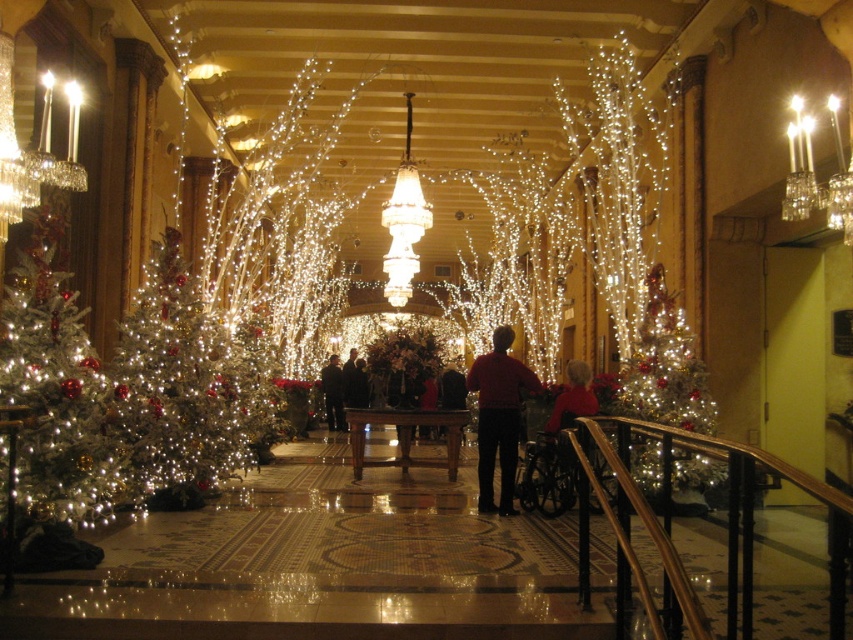
Question: Which of these objects is positioned farthest from the shiny silver christmas tree at right?

Choices:
 (A) dark red sweater at center
 (B) white frosted christmas tree at left

Answer: (B)

Question: Which point is farther to the camera?

Choices:
 (A) red velvet sweater at center
 (B) clear glass candlesticks at upper right

Answer: (A)

Question: Which of the following is the closest to the observer?

Choices:
 (A) (325, 371)
 (B) (688, 444)
 (C) (138, 461)
 (D) (38, 369)

Answer: (B)

Question: Can you confirm if clear glass candlesticks at upper right is positioned to the right of brown wooden table at center?

Choices:
 (A) yes
 (B) no

Answer: (A)

Question: Does matte black jacket at center appear over dark red sweater at center?

Choices:
 (A) no
 (B) yes

Answer: (A)

Question: Can you confirm if red matte shirt at center is smaller than clear glass candlesticks at upper right?

Choices:
 (A) no
 (B) yes

Answer: (B)